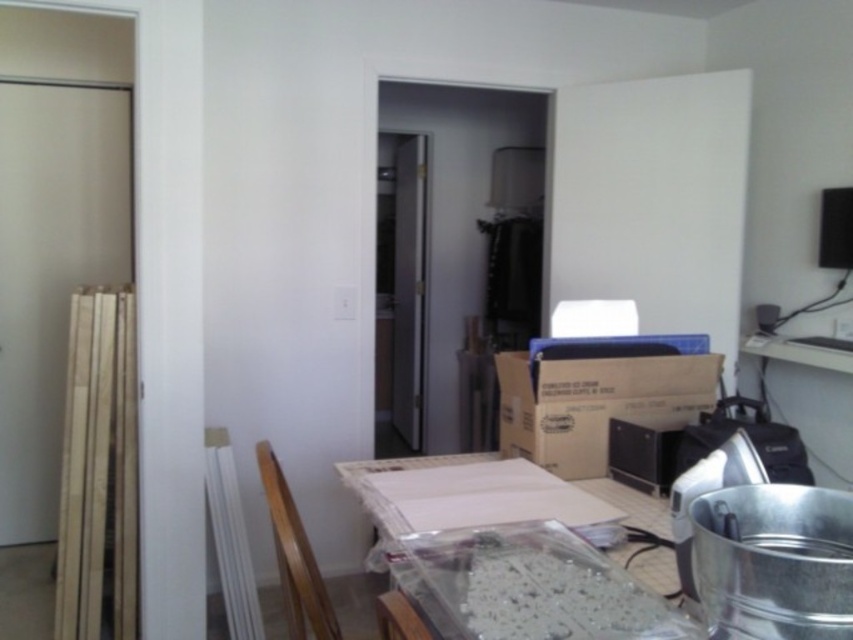
You are a worker standing 40 inches away from the clear plastic table at center. Can you comfortably reach the table without moving closer?

The clear plastic table at center is 37.99 inches away from the camera. Since you are standing 40 inches away, you are slightly farther than the table, so you might need to move a bit closer to comfortably reach it.

You are moving items out of the way to clean the floor. You need to move the brown cardboard box at center and the wooden chair at lower center. Which object should you move first to access the other?

You should move the brown cardboard box at center first because the wooden chair at lower center is behind it.

In the scene shown: You are moving a wooden chair at lower center to the other side of the clear plastic table at center. Considering their sizes, will the chair fit through the doorway that is 1.2 meters wide?

The clear plastic table at center is wider than the wooden chair at lower center. Since the doorway is 1.2 meters wide, the wooden chair at lower center can fit through the doorway as it is narrower than the table but the table itself may not fit. However, the question specifically asks about the chair, so yes, it can fit.